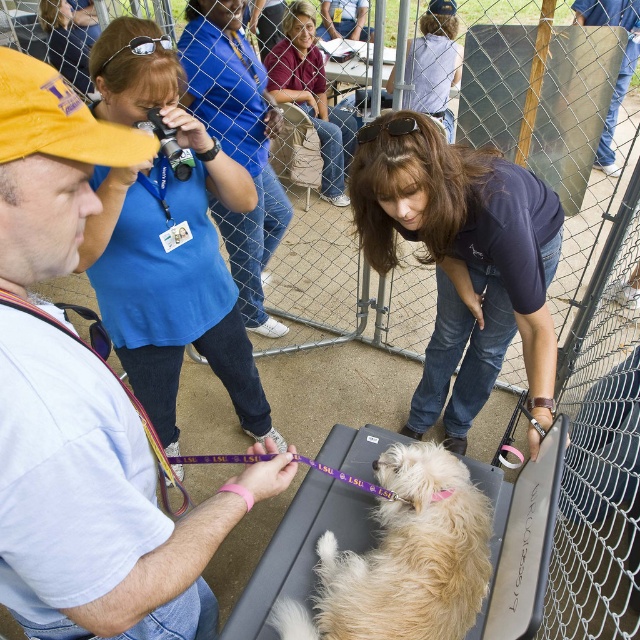
Is light blue shirt at left smaller than blue shirt at upper left?

Yes.

Between point (49, 550) and point (257, 129), which one is positioned behind?

The point (257, 129) is more distant.

Which is behind, point (129, 160) or point (202, 86)?

Positioned behind is point (202, 86).

Locate an element on the screen. This screenshot has width=640, height=640. light blue shirt at left is located at coordinates (96, 500).

Can you confirm if dark blue shirt at center is positioned below matte purple shirt at upper center?

Yes, dark blue shirt at center is below matte purple shirt at upper center.

Can you confirm if dark blue shirt at center is positioned to the left of matte purple shirt at upper center?

Incorrect, dark blue shirt at center is not on the left side of matte purple shirt at upper center.

Is point (477, 404) in front of point (298, 84)?

Yes, point (477, 404) is closer to viewer.

Identify the location of dark blue shirt at center. The image size is (640, 640). (461, 259).

Does light blue shirt at left lie in front of matte purple shirt at upper center?

Yes.

Does light blue shirt at left have a lesser height compared to matte purple shirt at upper center?

Indeed, light blue shirt at left has a lesser height compared to matte purple shirt at upper center.

This screenshot has width=640, height=640. I want to click on light blue shirt at left, so click(96, 500).